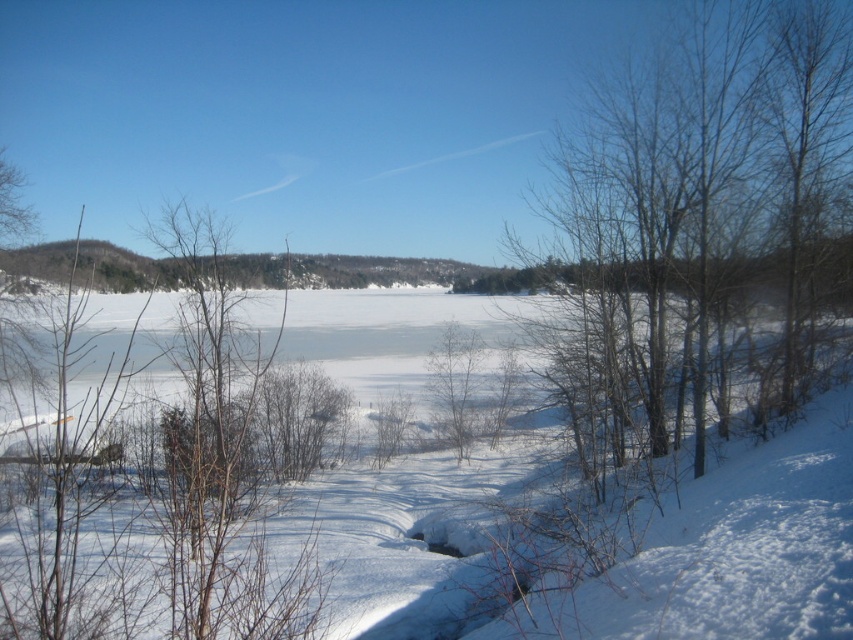
Question: Does bare branches at right appear over white fluffy snow at center?

Choices:
 (A) yes
 (B) no

Answer: (A)

Question: Which object appears closest to the camera in this image?

Choices:
 (A) bare branches at right
 (B) white fluffy snow at center

Answer: (B)

Question: Is bare branches at right bigger than white fluffy snow at center?

Choices:
 (A) no
 (B) yes

Answer: (A)

Question: Is bare branches at right above white fluffy snow at center?

Choices:
 (A) yes
 (B) no

Answer: (A)